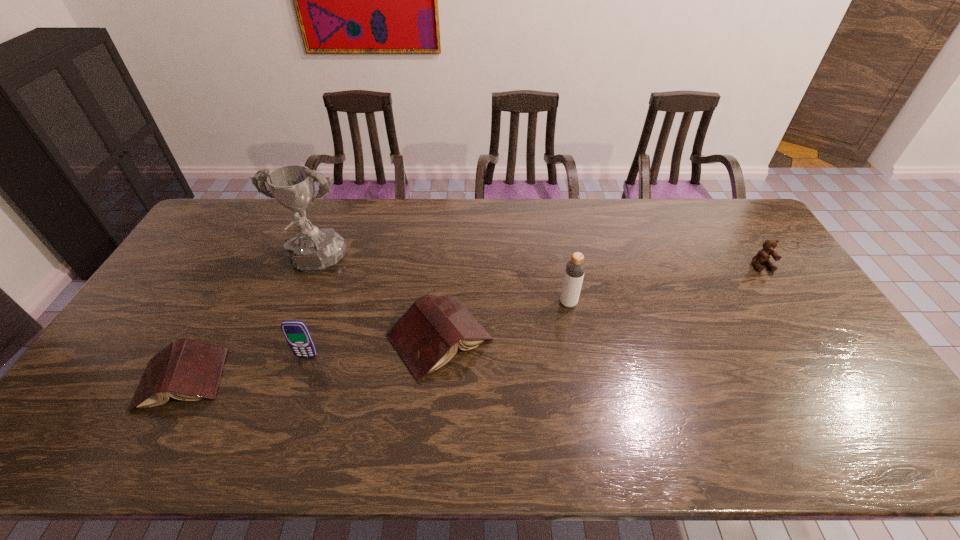
Locate an element on the screen. This screenshot has width=960, height=540. free spot between the shortest object and the fifth shortest object is located at coordinates (375, 341).

Find the location of `vacant point located between the third tallest object and the shortest object`. vacant point located between the third tallest object and the shortest object is located at coordinates (245, 368).

Locate an element on the screen. object that is the fifth closest to the award is located at coordinates (763, 256).

Choose which object is the third nearest neighbor to the rightmost object. Please provide its 2D coordinates. Your answer should be formatted as a tuple, i.e. [(x, y)], where the tuple contains the x and y coordinates of a point satisfying the conditions above.

[(312, 249)]

Find the location of `vacant position in the image that satisfies the following two spatial constraints: 1. on the back side of the shorter book; 2. on the left side of the fifth shortest object`. vacant position in the image that satisfies the following two spatial constraints: 1. on the back side of the shorter book; 2. on the left side of the fifth shortest object is located at coordinates (224, 303).

At what (x,y) coordinates should I click in order to perform the action: click on vacant space that satisfies the following two spatial constraints: 1. on the back side of the second tallest object; 2. on the right side of the shortest object. Please return your answer as a coordinate pair (x, y). Looking at the image, I should click on (224, 303).

This screenshot has width=960, height=540. Identify the location of blank space that satisfies the following two spatial constraints: 1. on the side with emblem of the award; 2. on the left side of the taller book. (285, 338).

At what (x,y) coordinates should I click in order to perform the action: click on vacant space that satisfies the following two spatial constraints: 1. on the side with emblem of the third object from right to left; 2. on the right side of the award. Please return your answer as a coordinate pair (x, y). This screenshot has width=960, height=540. Looking at the image, I should click on (285, 338).